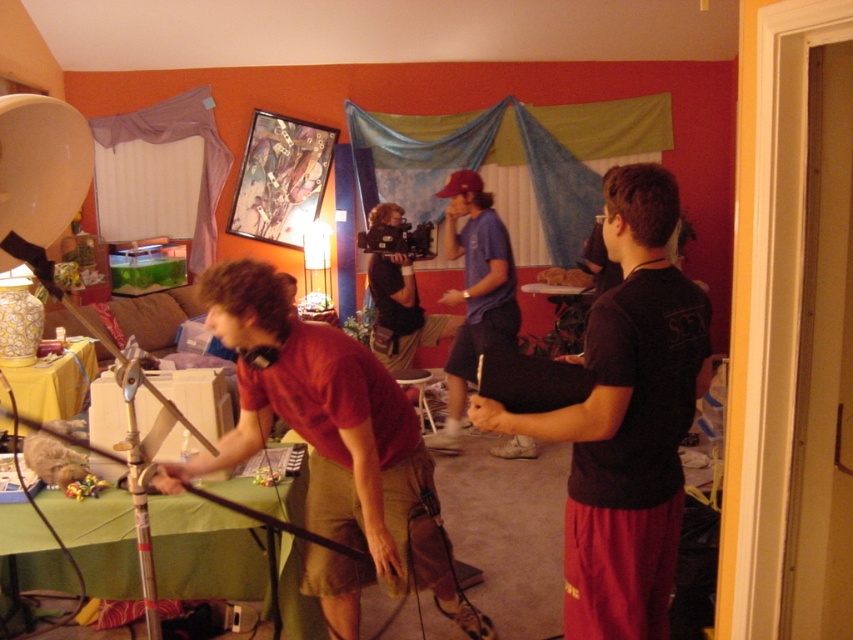
Between matte red shirt at center and matte blue shirt at center, which one is positioned lower?

matte red shirt at center is below.

Is matte red shirt at center above matte blue shirt at center?

No.

Which is in front, point (260, 420) or point (460, 348)?

Point (260, 420) is more forward.

Identify the location of matte red shirt at center. This screenshot has width=853, height=640. tap(331, 435).

Between point (604, 474) and point (489, 209), which one is positioned in front?

Point (604, 474) is in front.

Is black matte shirt at center bigger than matte blue shirt at center?

Incorrect, black matte shirt at center is not larger than matte blue shirt at center.

Does point (630, 413) come in front of point (462, 410)?

Yes, it is.

Locate an element on the screen. black matte shirt at center is located at coordinates (625, 419).

Consider the image. Does black matte shirt at center appear on the left side of matte red shirt at center?

No, black matte shirt at center is not to the left of matte red shirt at center.

Who is shorter, black matte shirt at center or matte red shirt at center?

Standing shorter between the two is black matte shirt at center.

What do you see at coordinates (625, 419) in the screenshot? I see `black matte shirt at center` at bounding box center [625, 419].

Identify the location of black matte shirt at center. (625, 419).